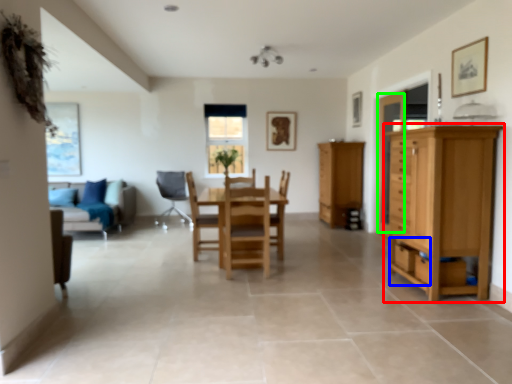
Question: Which object is positioned closest to cupboard (highlighted by a red box)? Select from drawer (highlighted by a blue box) and glass door (highlighted by a green box).

Choices:
 (A) drawer
 (B) glass door

Answer: (A)